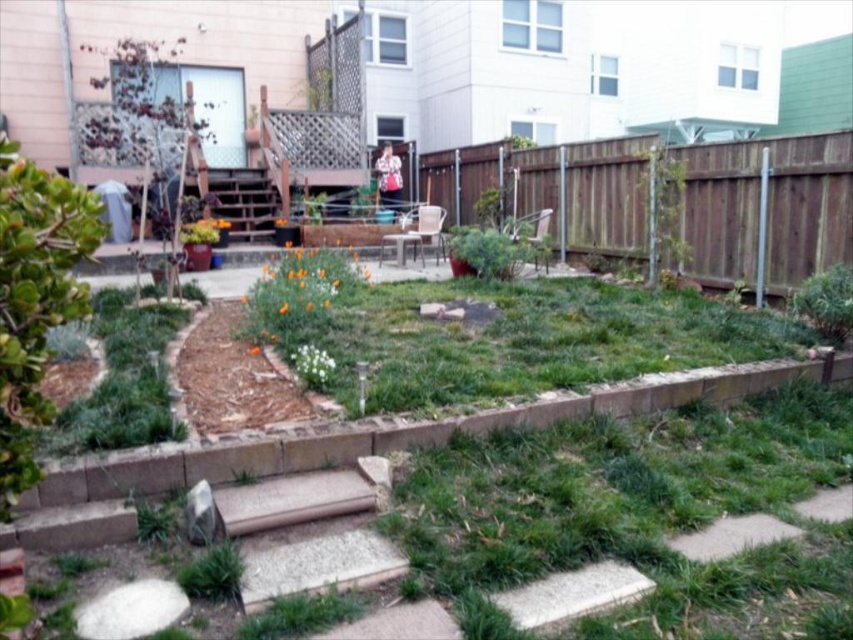
You are standing in the backyard and want to determine the relative positions of two points marked in the scene. Which point, point [321,545] or point [659,161], is closer to you?

Point [321,545] is closer to the viewer than point [659,161].

You are standing in the backyard and want to see over the brown wood stair at lower center to check if the garden bed is visible. Considering the height of the brown wooden fence at center, can you see over the stair?

The brown wooden fence at center is taller than the brown wood stair at lower center, so yes, you can see over the stair because the fence is higher.

You are a gardener who needs to water the green leafy plant at upper right using a hose that can reach 15 feet. You are currently standing next to the brown wood stair at lower center. Can you reach the plant without moving closer?

The brown wood stair at lower center and green leafy plant at upper right are 16.51 feet apart. Since the hose can only reach 15 feet, you cannot reach the plant without moving closer.